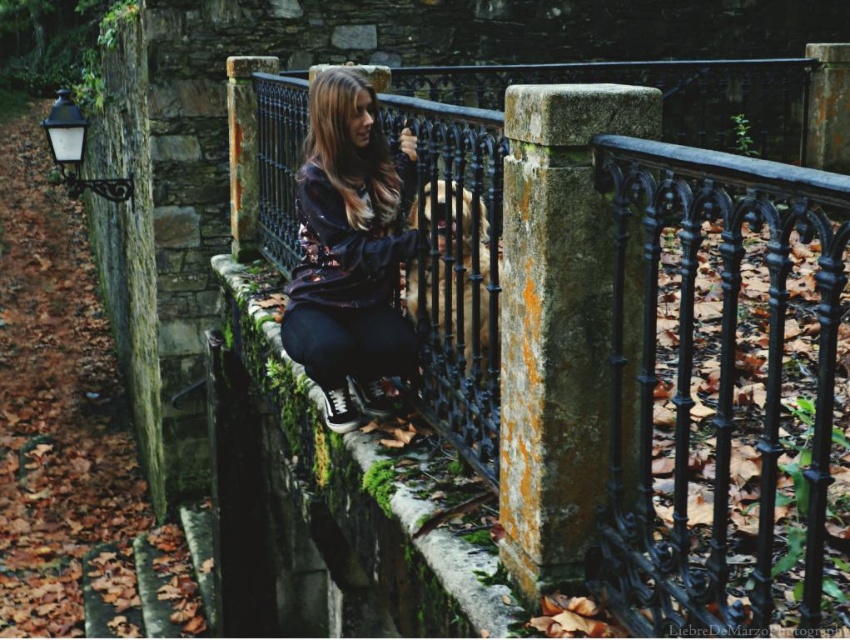
You are a painter wanting to paint the scene. You need to know if the black wrought iron railing at center right is wider than the shiny black hoodie at center. Can you confirm?

The black wrought iron railing at center right might be wider than shiny black hoodie at center according to the description.

You are a painter wanting to sketch the scene. You notice the black wrought iron railing at center right and the mossy stone ledge at center. Which object is above the other?

The black wrought iron railing at center right is positioned over mossy stone ledge at center, so it is above the mossy stone ledge at center.

You are standing at the point with coordinates (718, 385) in the image. What object are you standing on?

You are standing on the black wrought iron railing at center right.